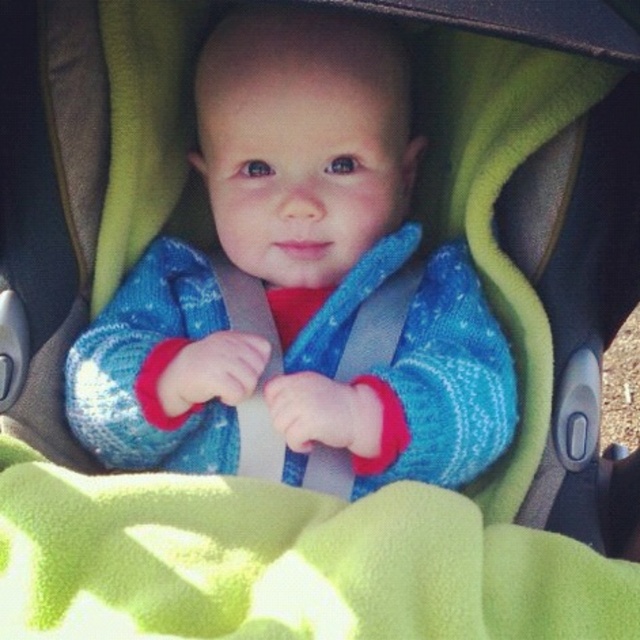
Measure the distance between blue knitted sweater at center and green fleece blanket at center.

blue knitted sweater at center and green fleece blanket at center are 23.75 centimeters apart from each other.

Between blue knitted sweater at center and green fleece blanket at center, which one appears on the left side from the viewer's perspective?

blue knitted sweater at center is more to the left.

Measure the distance between point [416,472] and camera.

Point [416,472] and camera are 37.85 inches apart from each other.

Where is `blue knitted sweater at center`? The image size is (640, 640). blue knitted sweater at center is located at coordinates (300, 285).